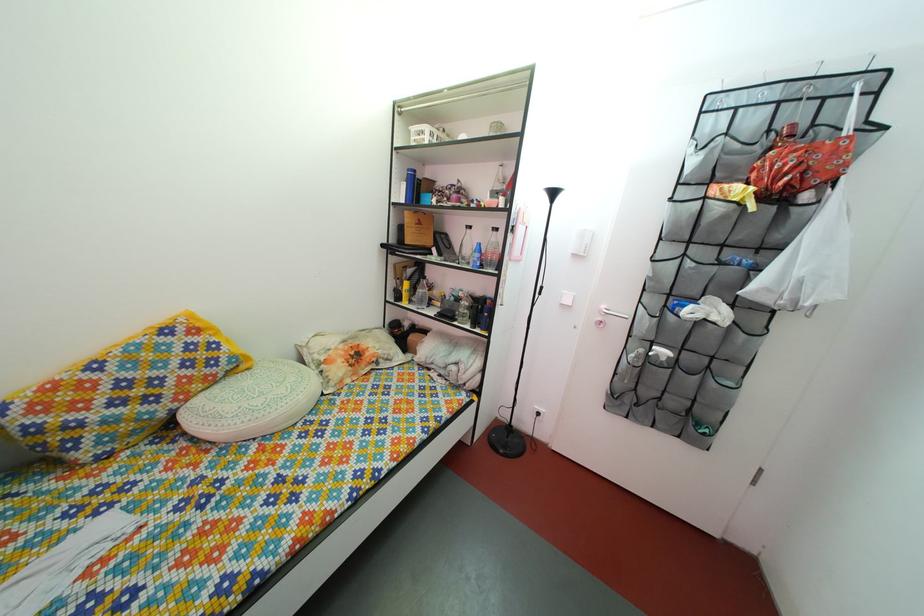
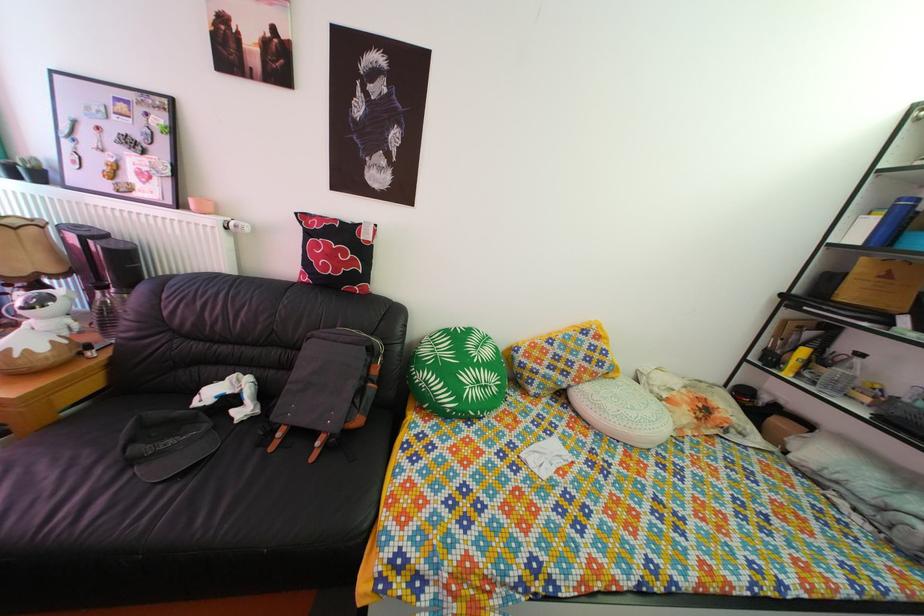
Question: The camera is either moving clockwise (left) or counter-clockwise (right) around the object. The first image is from the beginning of the video and the second image is from the end. Is the camera moving left or right when shooting the video?

Choices:
 (A) Left
 (B) Right

Answer: (B)